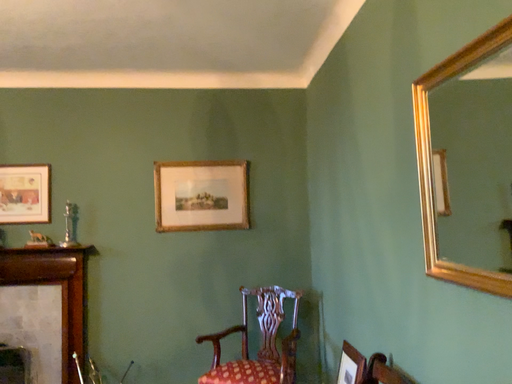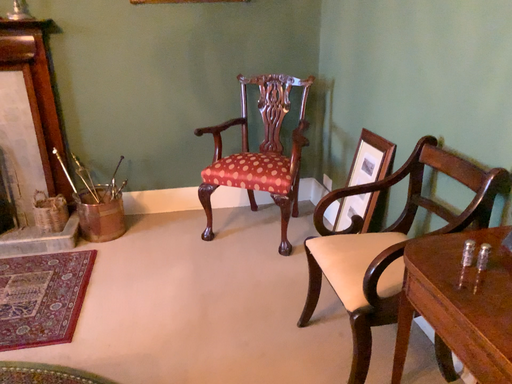
Question: How did the camera likely rotate when shooting the video?

Choices:
 (A) rotated upward
 (B) rotated downward

Answer: (B)